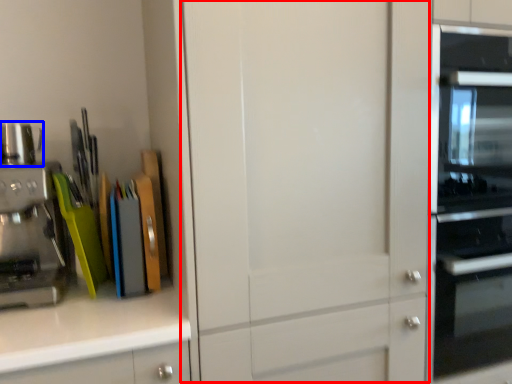
Question: Which object appears closest to the camera in this image, glass door (highlighted by a red box) or appliance (highlighted by a blue box)?

Choices:
 (A) glass door
 (B) appliance

Answer: (A)